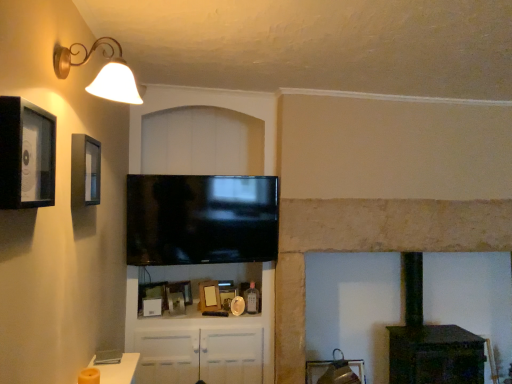
Locate an element on the screen. This screenshot has width=512, height=384. empty space that is ontop of black glossy flat-screen tv at center (from a real-world perspective) is located at coordinates (200, 178).